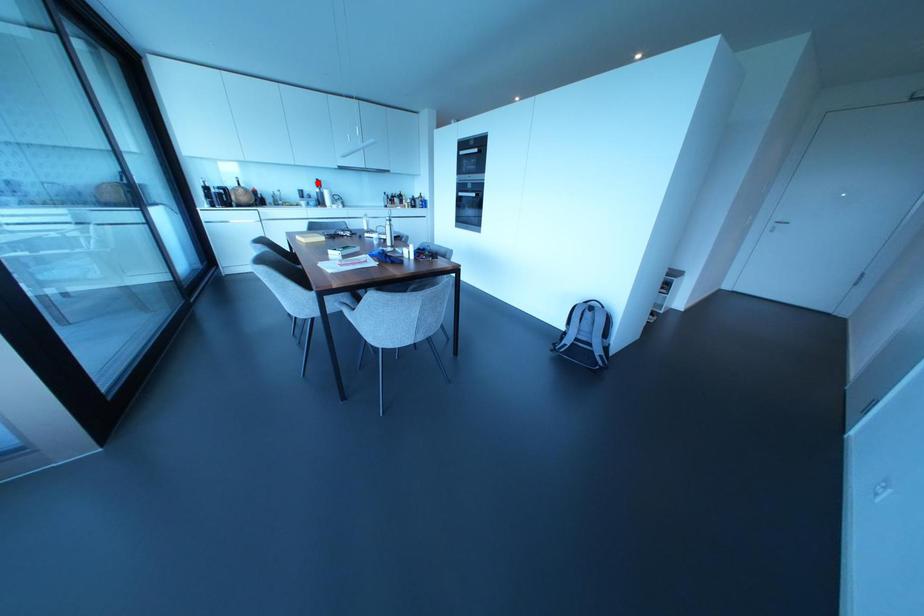
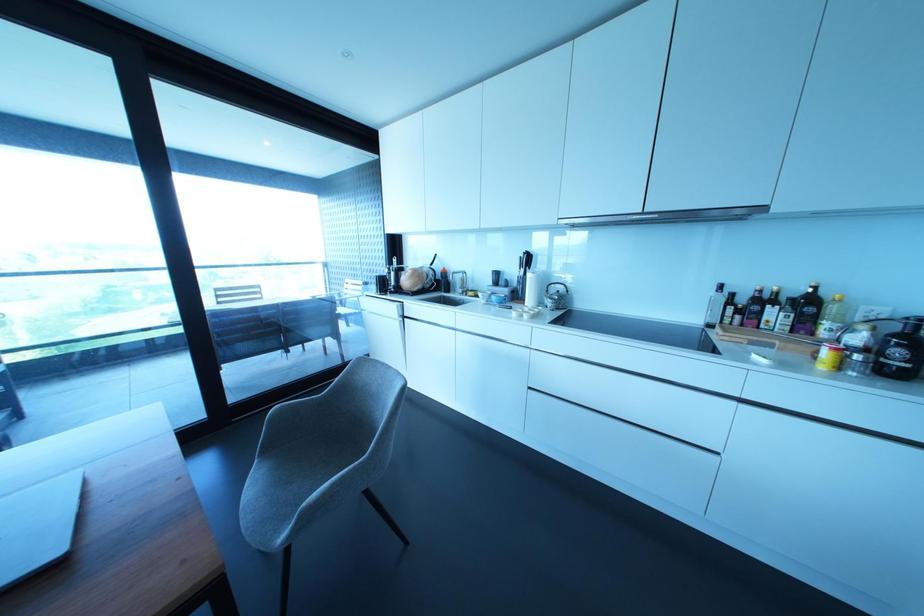
Question: I am providing you with two images of the same scene from different viewpoints. Image1 has a red point marked. In image2, the corresponding 3D location appears at what relative position? Reply with the corresponding letter.

Choices:
 (A) Closer
 (B) Farther

Answer: (B)